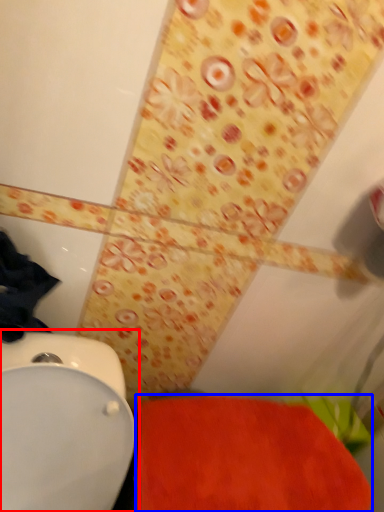
Question: Which object is further to the camera taking this photo, toilet (highlighted by a red box) or bath mat (highlighted by a blue box)?

Choices:
 (A) toilet
 (B) bath mat

Answer: (B)